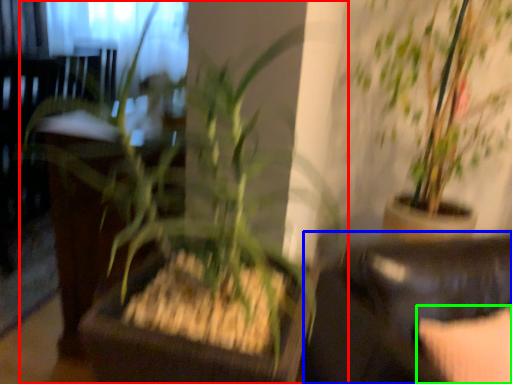
Question: Which object is the farthest from houseplant (highlighted by a red box)? Choose among these: rocking chair (highlighted by a blue box) or pillow (highlighted by a green box).

Choices:
 (A) rocking chair
 (B) pillow

Answer: (B)